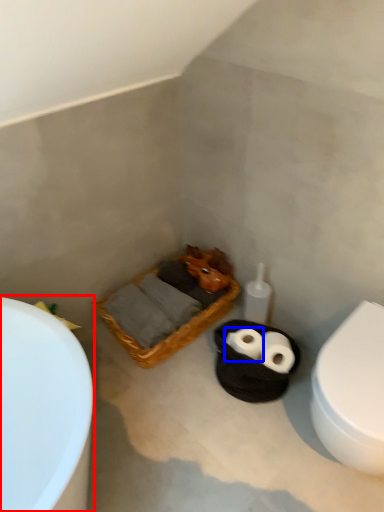
Question: Which object is closer to the camera taking this photo, bathtub (highlighted by a red box) or toilet paper (highlighted by a blue box)?

Choices:
 (A) bathtub
 (B) toilet paper

Answer: (A)